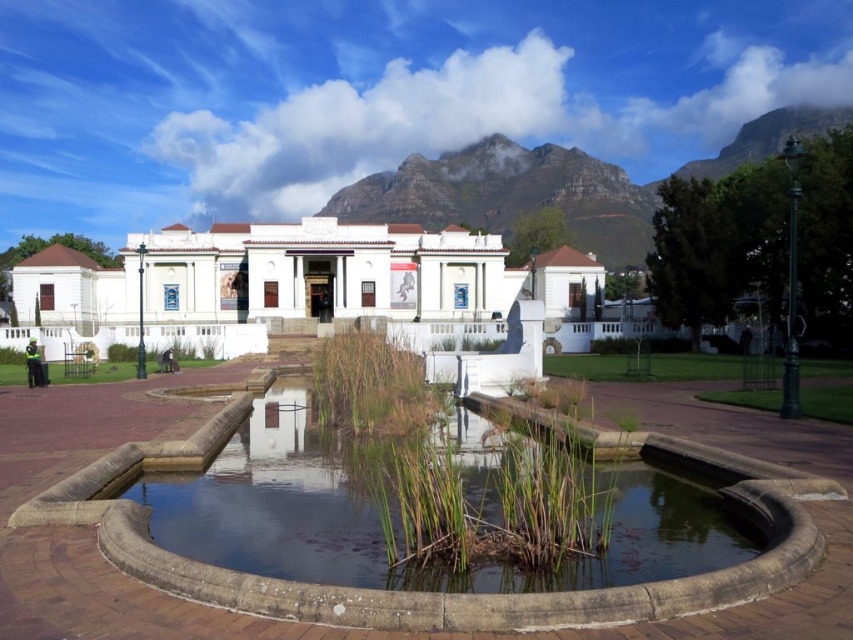
Question: Which point is farther to the camera?

Choices:
 (A) white smooth building at center
 (B) rugged stone mountain at upper center
 (C) green concrete pond at center

Answer: (B)

Question: From the image, what is the correct spatial relationship of green concrete pond at center in relation to rugged stone mountain at upper center?

Choices:
 (A) below
 (B) above

Answer: (A)

Question: Which point appears farthest from the camera in this image?

Choices:
 (A) (332, 304)
 (B) (457, 168)
 (C) (189, 513)

Answer: (B)

Question: Does white smooth building at center come behind rugged stone mountain at upper center?

Choices:
 (A) yes
 (B) no

Answer: (B)

Question: Which point is farther from the camera taking this photo?

Choices:
 (A) (762, 125)
 (B) (654, 492)
 (C) (345, 260)

Answer: (A)

Question: Can you confirm if green concrete pond at center is bigger than rugged stone mountain at upper center?

Choices:
 (A) no
 (B) yes

Answer: (A)